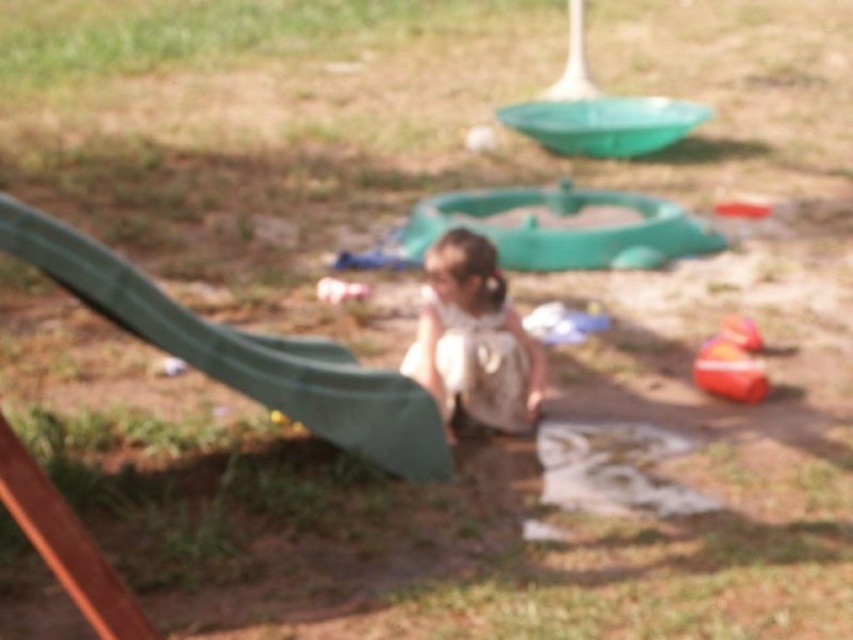
Who is more forward, (355, 371) or (457, 348)?

Point (355, 371) is in front.

Can you confirm if green matte slide at left is taller than white fabric toddler at center?

Yes, green matte slide at left is taller than white fabric toddler at center.

Locate an element on the screen. This screenshot has height=640, width=853. green matte slide at left is located at coordinates (244, 353).

Which is behind, point (39, 237) or point (737, 344)?

The point (737, 344) is more distant.

Is green matte slide at left positioned at the back of orange rubber boat at lower right?

No, it is in front of orange rubber boat at lower right.

Is point (22, 209) farther from camera compared to point (738, 346)?

No, (22, 209) is in front of (738, 346).

Find the location of `green matte slide at left`. green matte slide at left is located at coordinates (244, 353).

Between point (509, 360) and point (764, 384), which one is positioned behind?

The point (764, 384) is behind.

Which is more to the left, white fabric toddler at center or orange rubber boat at lower right?

white fabric toddler at center is more to the left.

Is point (471, 300) farther from viewer compared to point (766, 376)?

No, (471, 300) is in front of (766, 376).

You are a GUI agent. You are given a task and a screenshot of the screen. Output one action in this format:
    pyautogui.click(x=<x>, y=<y>)
    Task: Click on the white fabric toddler at center
    
    Given the screenshot: What is the action you would take?
    pyautogui.click(x=473, y=339)